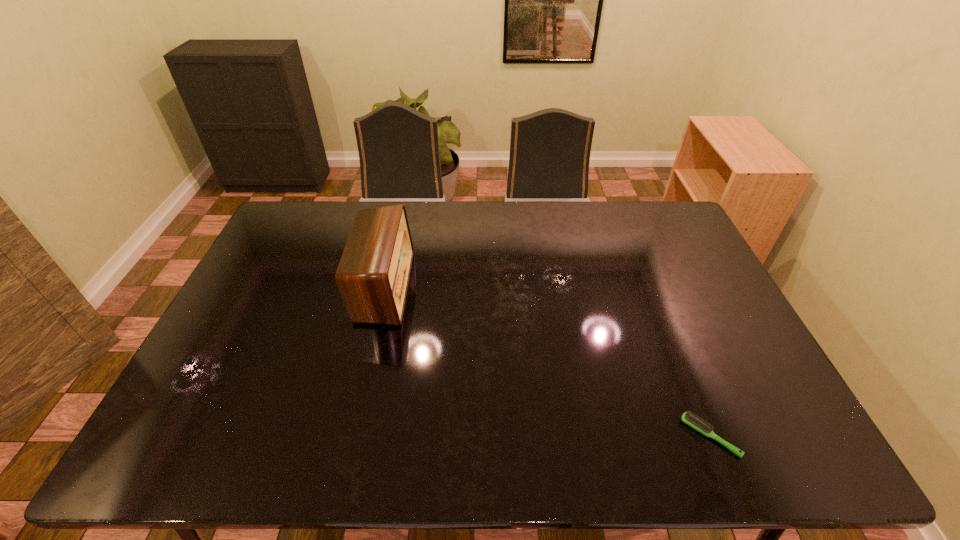
This screenshot has height=540, width=960. What are the coordinates of `vacant region that satisfies the following two spatial constraints: 1. on the front-facing side of the farther object; 2. on the left side of the nearer object` in the screenshot? It's located at (349, 436).

Where is `vacant space that satisfies the following two spatial constraints: 1. on the front-facing side of the farther object; 2. on the back side of the nearer object`? vacant space that satisfies the following two spatial constraints: 1. on the front-facing side of the farther object; 2. on the back side of the nearer object is located at coordinates (349, 436).

Identify the location of vacant space that satisfies the following two spatial constraints: 1. on the back side of the shorter object; 2. on the front-facing side of the taller object. Image resolution: width=960 pixels, height=540 pixels. (650, 287).

The image size is (960, 540). I want to click on vacant space that satisfies the following two spatial constraints: 1. on the front-facing side of the taller object; 2. on the left side of the nearer object, so click(x=349, y=436).

This screenshot has width=960, height=540. I want to click on vacant space that satisfies the following two spatial constraints: 1. on the back side of the hairbrush; 2. on the front-facing side of the radio receiver, so click(650, 287).

Where is `vacant space that satisfies the following two spatial constraints: 1. on the front-facing side of the hairbrush; 2. on the left side of the farther object`? vacant space that satisfies the following two spatial constraints: 1. on the front-facing side of the hairbrush; 2. on the left side of the farther object is located at coordinates (349, 436).

The height and width of the screenshot is (540, 960). Identify the location of vacant space that satisfies the following two spatial constraints: 1. on the front-facing side of the shorter object; 2. on the right side of the farther object. (349, 436).

The image size is (960, 540). I want to click on vacant area in the image that satisfies the following two spatial constraints: 1. on the front-facing side of the right object; 2. on the left side of the left object, so click(349, 436).

I want to click on free point that satisfies the following two spatial constraints: 1. on the front-facing side of the nearer object; 2. on the left side of the taller object, so click(349, 436).

Where is `blank area in the image that satisfies the following two spatial constraints: 1. on the front-facing side of the farther object; 2. on the left side of the right object`? Image resolution: width=960 pixels, height=540 pixels. blank area in the image that satisfies the following two spatial constraints: 1. on the front-facing side of the farther object; 2. on the left side of the right object is located at coordinates (349, 436).